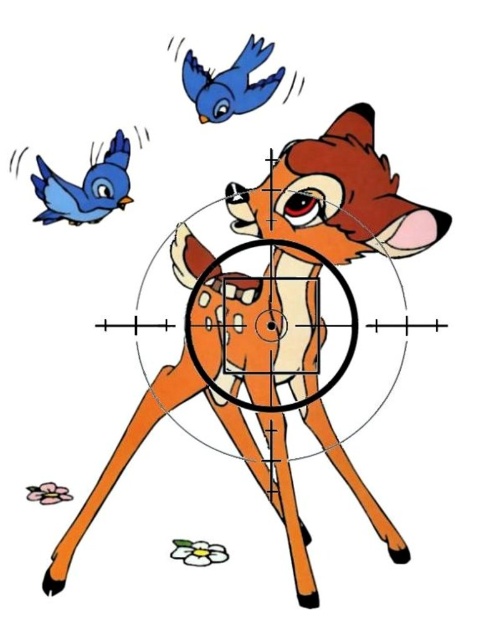
Question: Does orange matte deer at center have a larger size compared to matte blue bird at upper left?

Choices:
 (A) yes
 (B) no

Answer: (A)

Question: Is orange matte deer at center to the left of matte blue bird at upper left from the viewer's perspective?

Choices:
 (A) no
 (B) yes

Answer: (A)

Question: Is orange matte deer at center smaller than matte blue bird at upper left?

Choices:
 (A) no
 (B) yes

Answer: (A)

Question: Which object is farther from the camera taking this photo?

Choices:
 (A) orange matte deer at center
 (B) matte blue bird at upper left

Answer: (B)

Question: Which point is closer to the camera taking this photo?

Choices:
 (A) (109, 161)
 (B) (288, 212)

Answer: (A)